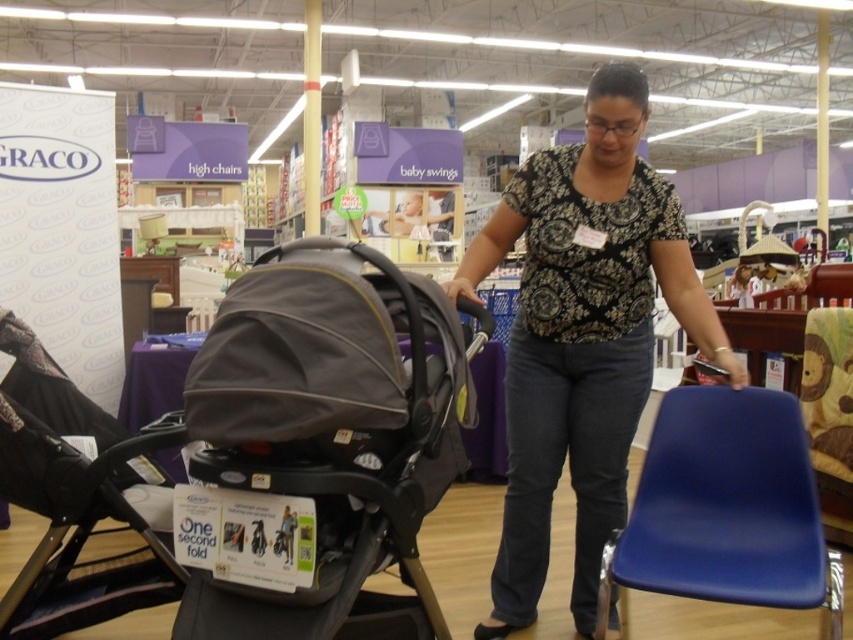
What do you see at coordinates (582, 337) in the screenshot? This screenshot has width=853, height=640. I see `printed cotton blouse at center` at bounding box center [582, 337].

How far apart are printed cotton blouse at center and matte black stroller at center?

printed cotton blouse at center and matte black stroller at center are 1.28 meters apart.

Does point (567, 160) come in front of point (22, 458)?

No, (567, 160) is behind (22, 458).

The height and width of the screenshot is (640, 853). What are the coordinates of `printed cotton blouse at center` in the screenshot? It's located at (582, 337).

Can you confirm if printed cotton blouse at center is bigger than blue plastic chair at lower right?

Yes.

Is printed cotton blouse at center smaller than blue plastic chair at lower right?

Actually, printed cotton blouse at center might be larger than blue plastic chair at lower right.

Measure the distance between printed cotton blouse at center and camera.

printed cotton blouse at center and camera are 6.80 feet apart from each other.

Locate an element on the screen. The width and height of the screenshot is (853, 640). printed cotton blouse at center is located at coordinates (582, 337).

Is gray fabric stroller at center to the left of blue plastic chair at lower right from the viewer's perspective?

Yes, gray fabric stroller at center is to the left of blue plastic chair at lower right.

Is gray fabric stroller at center closer to camera compared to blue plastic chair at lower right?

Yes, it is in front of blue plastic chair at lower right.

Is point (421, 368) farther from viewer compared to point (714, 465)?

No, it is in front of (714, 465).

At what (x,y) coordinates should I click in order to perform the action: click on gray fabric stroller at center. Please return your answer as a coordinate pair (x, y). This screenshot has height=640, width=853. Looking at the image, I should click on (318, 448).